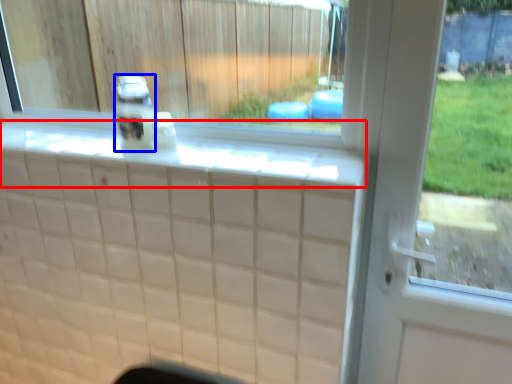
Question: Which of the following is the closest to the observer, ledge (highlighted by a red box) or bottle (highlighted by a blue box)?

Choices:
 (A) ledge
 (B) bottle

Answer: (A)